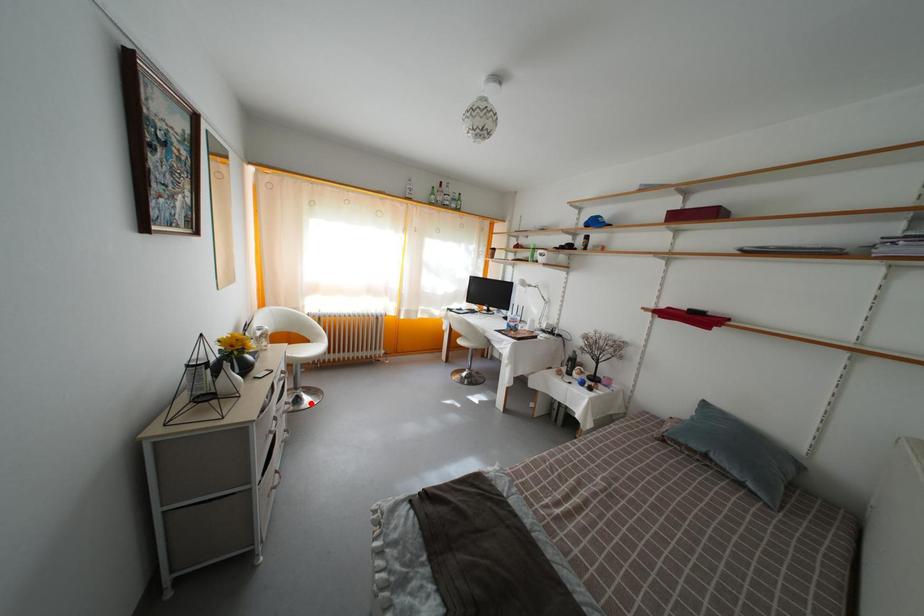
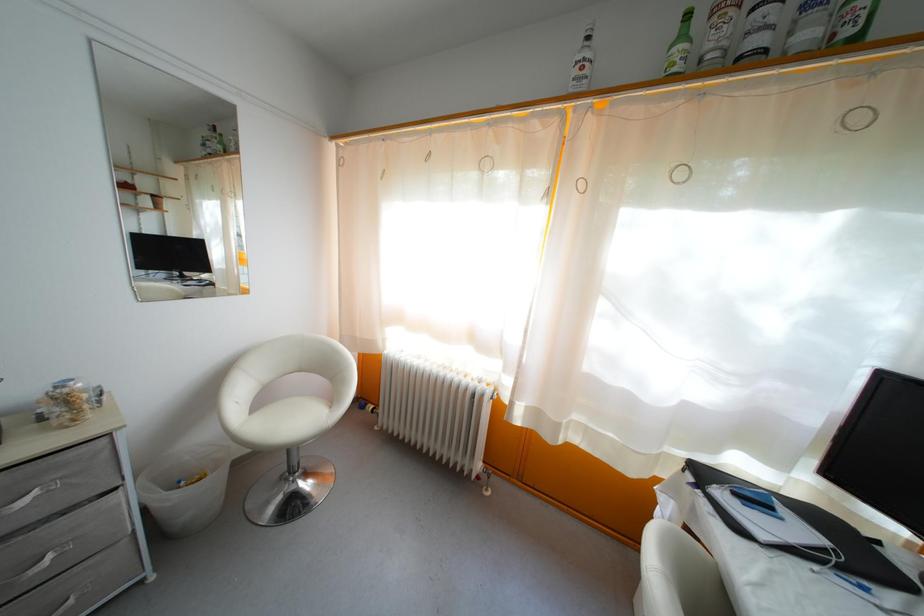
Find the pixel in the second image that matches the highlighted location in the first image.

(282, 505)